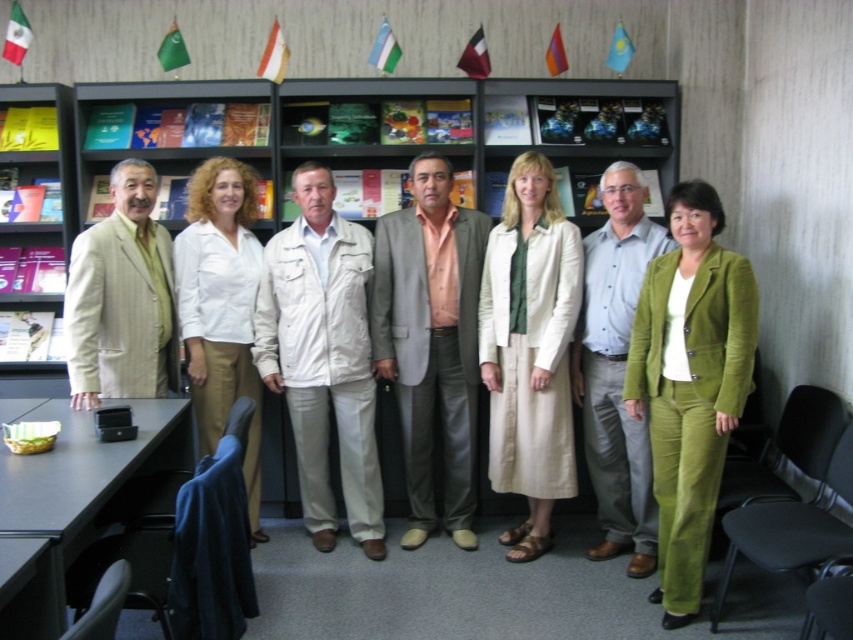
Question: Which point is closer to the camera?

Choices:
 (A) (194, 340)
 (B) (561, 272)
 (C) (120, 388)
 (D) (625, 310)

Answer: (D)

Question: Among these objects, which one is nearest to the camera?

Choices:
 (A) matte white skirt at center
 (B) light gray suit at center

Answer: (A)

Question: Can you confirm if light gray suit at center is positioned above light blue shirt at center?

Choices:
 (A) no
 (B) yes

Answer: (B)

Question: Can you confirm if white cotton jacket at center is positioned to the right of light gray suit at center?

Choices:
 (A) yes
 (B) no

Answer: (B)

Question: Can you confirm if matte white skirt at center is positioned to the right of light blue shirt at center?

Choices:
 (A) yes
 (B) no

Answer: (B)

Question: Which object is the farthest from the beige textured suit at left?

Choices:
 (A) green corduroy suit at center
 (B) white cotton blouse at center
 (C) white cotton jacket at center

Answer: (A)